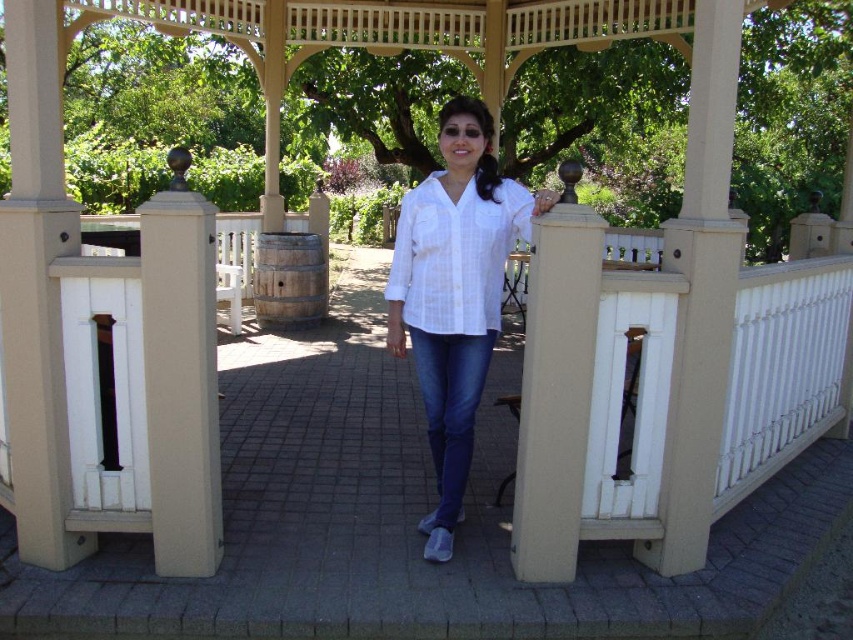
Locate an element on the screen. The height and width of the screenshot is (640, 853). beige smooth post at center is located at coordinates (181, 376).

Measure the distance between point (177,147) and camera.

The distance of point (177,147) from camera is 66.02 feet.

Locate an element on the screen. beige smooth post at center is located at coordinates 181,376.

Where is `beige smooth post at center`? This screenshot has width=853, height=640. beige smooth post at center is located at coordinates (181, 376).

Does beige smooth post at center appear over denim jeans at center?

Correct, beige smooth post at center is located above denim jeans at center.

Describe the element at coordinates (181, 376) in the screenshot. The image size is (853, 640). I see `beige smooth post at center` at that location.

Measure the distance between beige smooth post at center and camera.

beige smooth post at center and camera are 2.43 meters apart from each other.

This screenshot has height=640, width=853. Identify the location of beige smooth post at center. (181, 376).

In the scene shown: Is beige concrete post at center wider than denim jeans at center?

No.

Where is `beige concrete post at center`? The height and width of the screenshot is (640, 853). beige concrete post at center is located at coordinates (556, 387).

Is point (527, 412) behind point (474, 346)?

No, it is not.

You are a GUI agent. You are given a task and a screenshot of the screen. Output one action in this format:
    pyautogui.click(x=<x>, y=<y>)
    Task: Click on the beige concrete post at center
    The image size is (853, 640).
    Given the screenshot: What is the action you would take?
    pyautogui.click(x=556, y=387)